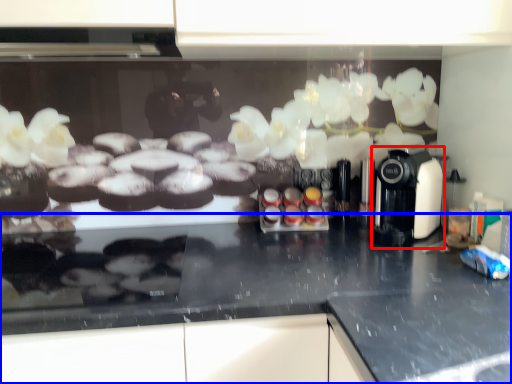
Question: Which point is closer to the camera, coffee machine (highlighted by a red box) or countertop (highlighted by a blue box)?

Choices:
 (A) coffee machine
 (B) countertop

Answer: (B)